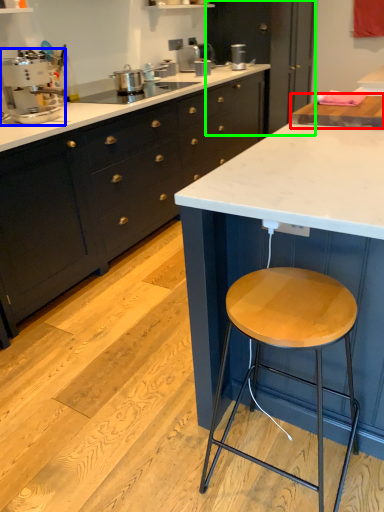
Question: Based on their relative distances, which object is farther from countertop (highlighted by a red box)? Choose from appliance (highlighted by a blue box) and cabinetry (highlighted by a green box).

Choices:
 (A) appliance
 (B) cabinetry

Answer: (B)